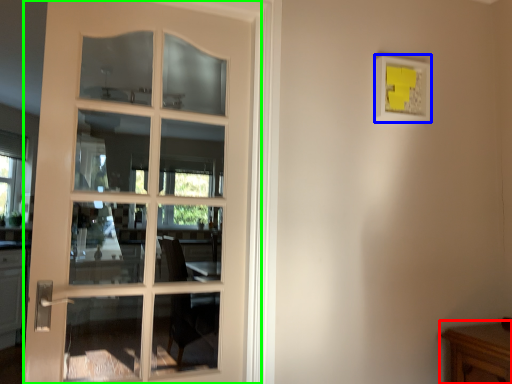
Question: Which is nearer to the table (highlighted by a red box)? picture frame (highlighted by a blue box) or door (highlighted by a green box).

Choices:
 (A) picture frame
 (B) door

Answer: (A)